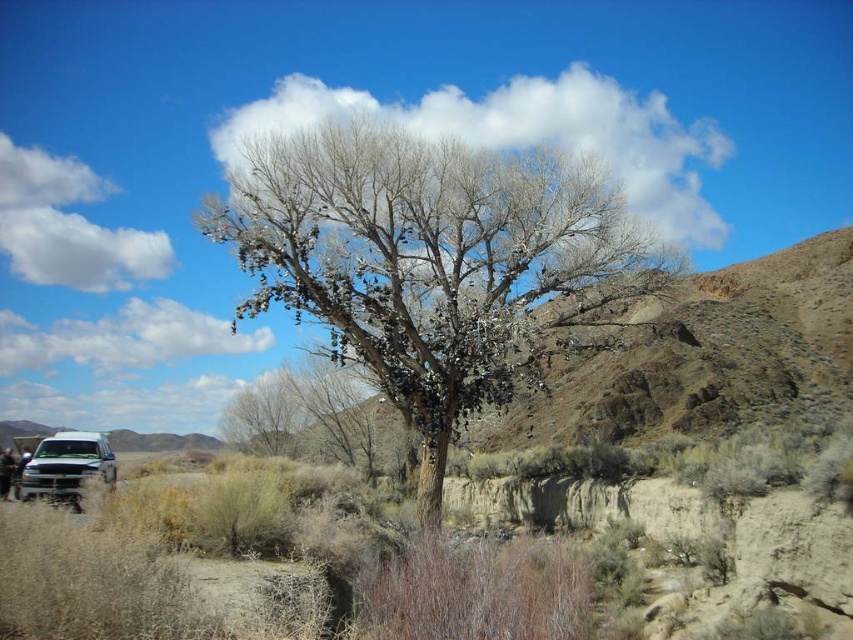
Describe the element at coordinates (426, 260) in the screenshot. The image size is (853, 640). I see `bare branches at center` at that location.

Does point (376, 364) lie in front of point (235, 433)?

Yes, it is in front of point (235, 433).

Between point (412, 342) and point (258, 433), which one is positioned in front?

Point (412, 342)

The image size is (853, 640). I want to click on bare branches at center, so click(x=426, y=260).

Is point (108, 477) in front of point (251, 433)?

Yes, it is.

Who is positioned more to the left, silver metallic truck at lower left or gray bark tree at center?

From the viewer's perspective, silver metallic truck at lower left appears more on the left side.

Find the location of `silver metallic truck at lower left`. silver metallic truck at lower left is located at coordinates (67, 467).

Image resolution: width=853 pixels, height=640 pixels. I want to click on silver metallic truck at lower left, so click(x=67, y=467).

Which of these two, bare branches at center or silver metallic truck at lower left, stands shorter?

With less height is silver metallic truck at lower left.

What do you see at coordinates (426, 260) in the screenshot? The image size is (853, 640). I see `bare branches at center` at bounding box center [426, 260].

The image size is (853, 640). I want to click on bare branches at center, so click(x=426, y=260).